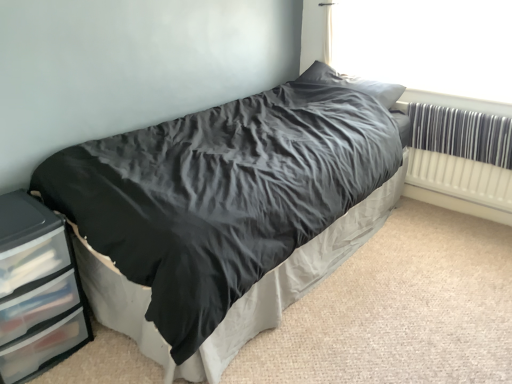
Question: Does satin gray pillow at upper center appear on the right side of white plastic radiator at right?

Choices:
 (A) no
 (B) yes

Answer: (A)

Question: Is satin gray pillow at upper center facing away from white plastic radiator at right?

Choices:
 (A) yes
 (B) no

Answer: (B)

Question: From a real-world perspective, is satin gray pillow at upper center physically above white plastic radiator at right?

Choices:
 (A) no
 (B) yes

Answer: (B)

Question: From a real-world perspective, is satin gray pillow at upper center physically below white plastic radiator at right?

Choices:
 (A) yes
 (B) no

Answer: (B)

Question: Is satin gray pillow at upper center outside of white plastic radiator at right?

Choices:
 (A) yes
 (B) no

Answer: (A)

Question: Considering their positions, is white plastic radiator at right located in front of or behind transparent plastic window screen at upper right?

Choices:
 (A) behind
 (B) front

Answer: (A)

Question: Is white plastic radiator at right wider or thinner than transparent plastic window screen at upper right?

Choices:
 (A) wide
 (B) thin

Answer: (B)

Question: In the image, is white plastic radiator at right on the left side or the right side of transparent plastic window screen at upper right?

Choices:
 (A) left
 (B) right

Answer: (B)

Question: From a real-world perspective, is white plastic radiator at right positioned above or below transparent plastic window screen at upper right?

Choices:
 (A) below
 (B) above

Answer: (A)

Question: Considering the positions of point (38, 274) and point (431, 16), is point (38, 274) closer or farther from the camera than point (431, 16)?

Choices:
 (A) farther
 (B) closer

Answer: (B)

Question: Would you say clear plastic chest of drawers at lower left is inside or outside transparent plastic window screen at upper right?

Choices:
 (A) inside
 (B) outside

Answer: (B)

Question: From a real-world perspective, is clear plastic chest of drawers at lower left positioned above or below transparent plastic window screen at upper right?

Choices:
 (A) below
 (B) above

Answer: (A)

Question: Considering their positions, is clear plastic chest of drawers at lower left located in front of or behind transparent plastic window screen at upper right?

Choices:
 (A) front
 (B) behind

Answer: (A)

Question: Is matte black bed at center taller or shorter than satin gray pillow at upper center?

Choices:
 (A) tall
 (B) short

Answer: (A)

Question: Looking at their shapes, would you say matte black bed at center is wider or thinner than satin gray pillow at upper center?

Choices:
 (A) thin
 (B) wide

Answer: (B)